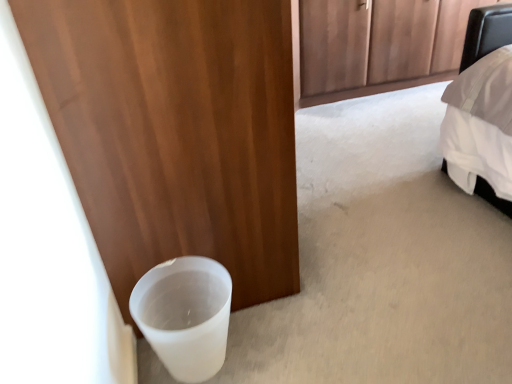
You are a GUI agent. You are given a task and a screenshot of the screen. Output one action in this format:
    pyautogui.click(x=<x>, y=<y>)
    Task: Click on the vacant space to the right of white matte door at lower left
    
    Given the screenshot: What is the action you would take?
    pyautogui.click(x=384, y=162)